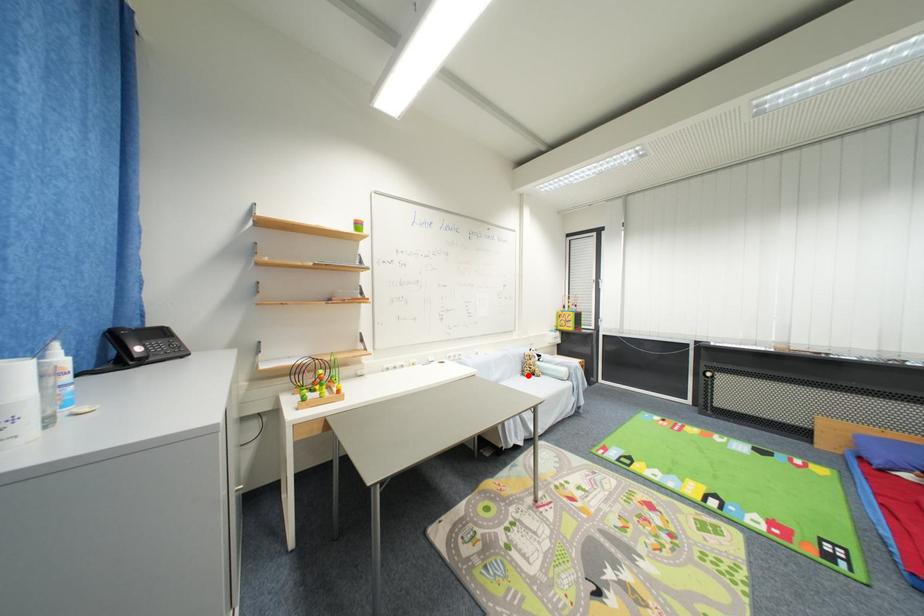
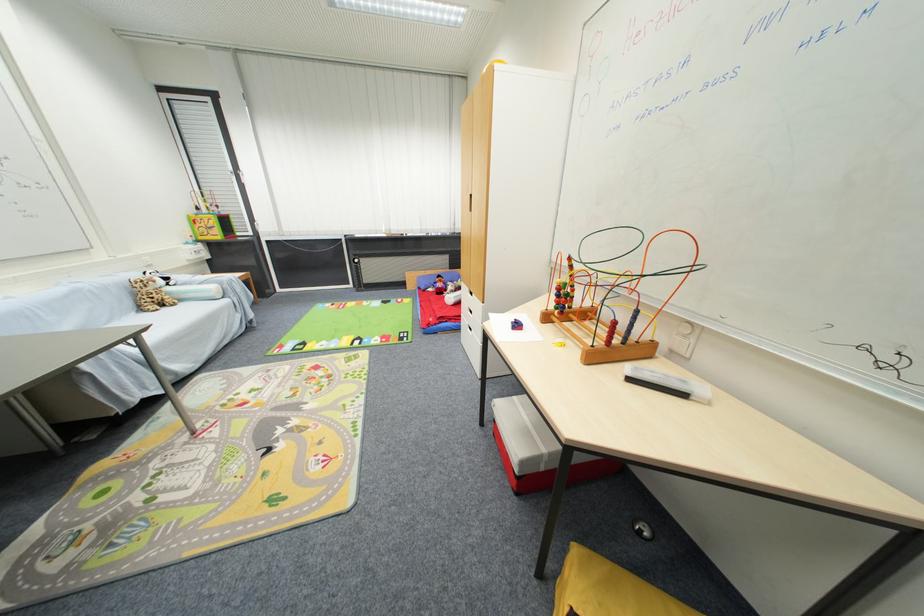
In the second image, find the point that corresponds to the highlighted location in the first image.

(146, 310)